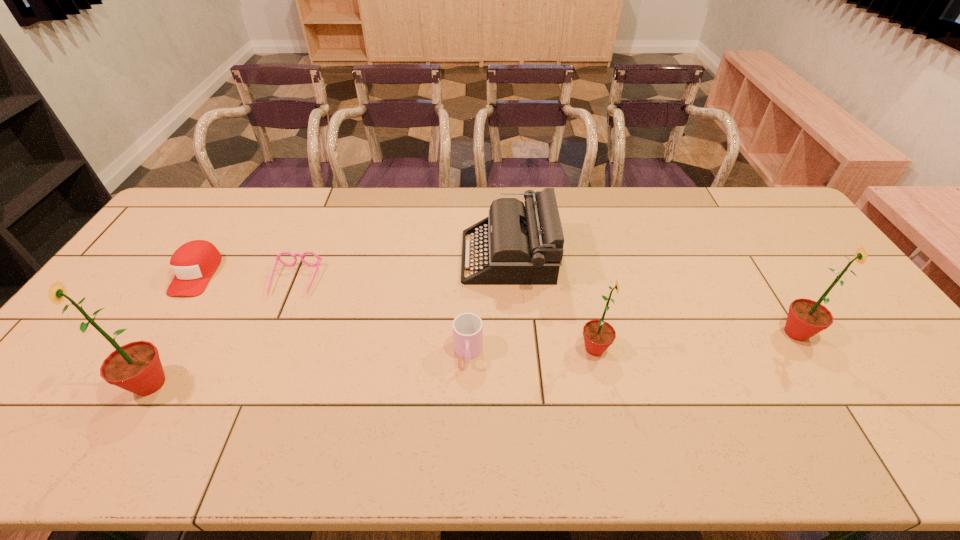
The image size is (960, 540). In order to click on vacant position for inserting another sunflower evenly in this screenshot , I will do `click(380, 366)`.